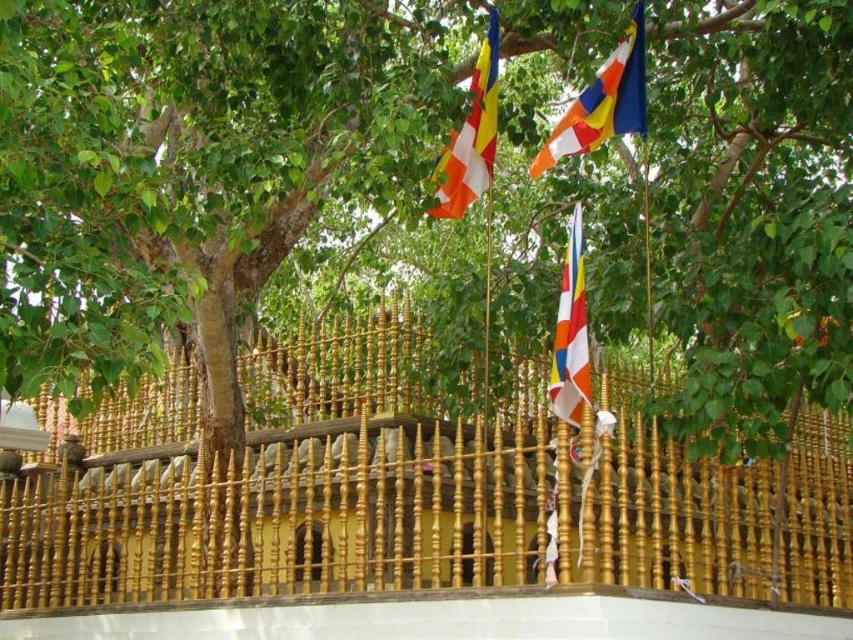
Question: Which point is closer to the camera taking this photo?

Choices:
 (A) click(572, 225)
 (B) click(482, 436)

Answer: (A)

Question: Is multi-colored fabric flag at upper center bigger than striped fabric flag at center?

Choices:
 (A) yes
 (B) no

Answer: (B)

Question: Considering the real-world distances, which object is farthest from the striped fabric flag at center?

Choices:
 (A) orange and white striped flag at upper center
 (B) gold polished fence at center

Answer: (B)

Question: Which point appears farthest from the camera in this image?

Choices:
 (A) (701, 560)
 (B) (535, 170)
 (C) (486, 100)
 (D) (550, 381)

Answer: (B)

Question: Does gold polished fence at center have a greater width compared to multi-colored fabric flag at upper center?

Choices:
 (A) yes
 (B) no

Answer: (A)

Question: Is gold polished fence at center below orange and white striped flag at upper center?

Choices:
 (A) no
 (B) yes

Answer: (B)